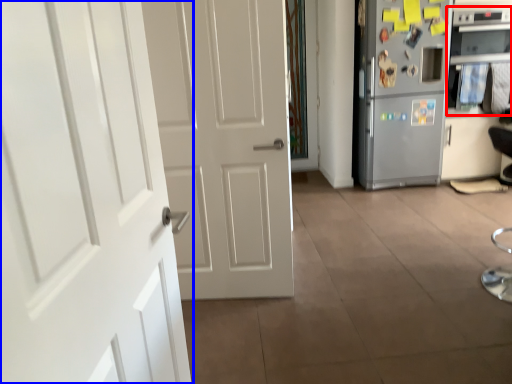
Question: Among these objects, which one is farthest to the camera, oven (highlighted by a red box) or door (highlighted by a blue box)?

Choices:
 (A) oven
 (B) door

Answer: (A)